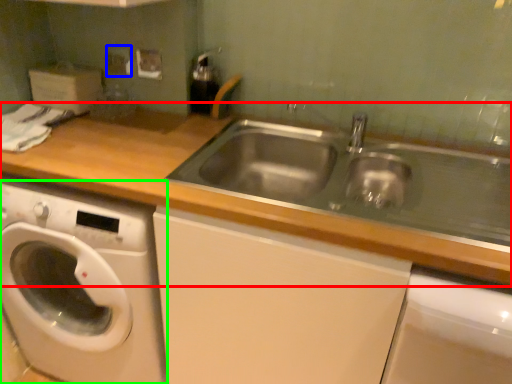
Question: Based on their relative distances, which object is nearer to countertop (highlighted by a red box)? Choose from electric outlet (highlighted by a blue box) and washing machine (highlighted by a green box).

Choices:
 (A) electric outlet
 (B) washing machine

Answer: (B)